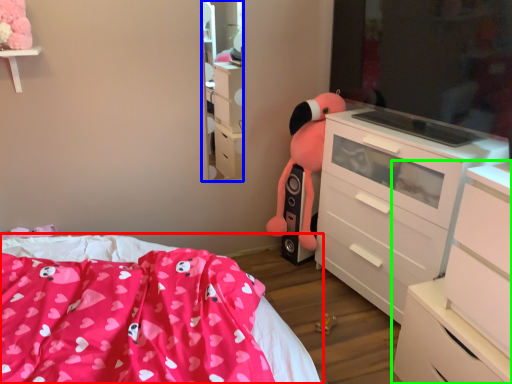
Question: Based on their relative distances, which object is nearer to bed (highlighted by a red box)? Choose from mirror (highlighted by a blue box) and chest of drawers (highlighted by a green box).

Choices:
 (A) mirror
 (B) chest of drawers

Answer: (B)